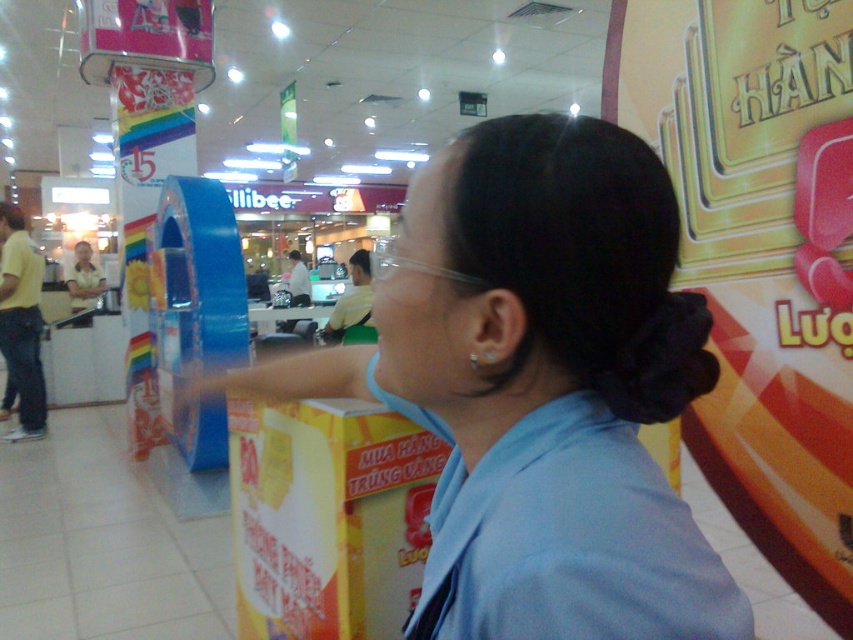
Based on the photo, which is above, blue fabric shirt at center or transparent plastic glasses at center?

transparent plastic glasses at center

Is point (718, 589) closer to viewer compared to point (387, 273)?

That is True.

Find the location of a particular element. This screenshot has height=640, width=853. blue fabric shirt at center is located at coordinates (538, 388).